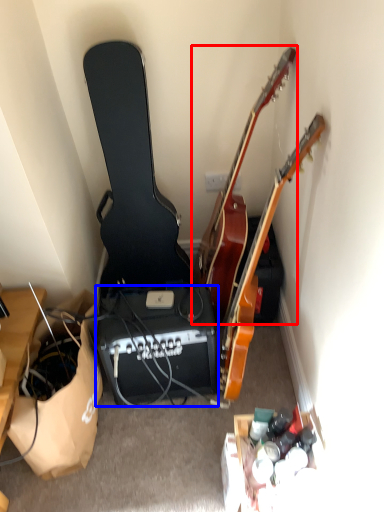
Question: Which object is further to the camera taking this photo, guitar (highlighted by a red box) or speaker (highlighted by a blue box)?

Choices:
 (A) guitar
 (B) speaker

Answer: (B)